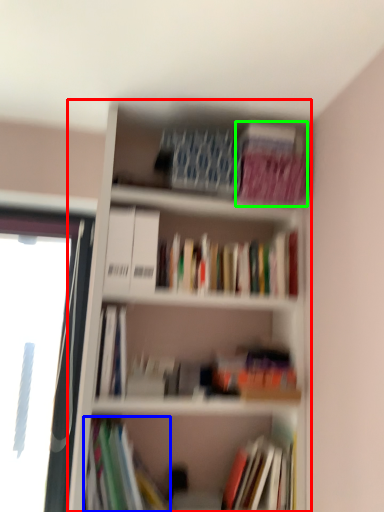
Question: Which object is the closest to the bookcase (highlighted by a red box)? Choose among these: book (highlighted by a blue box) or paperback book (highlighted by a green box).

Choices:
 (A) book
 (B) paperback book

Answer: (B)